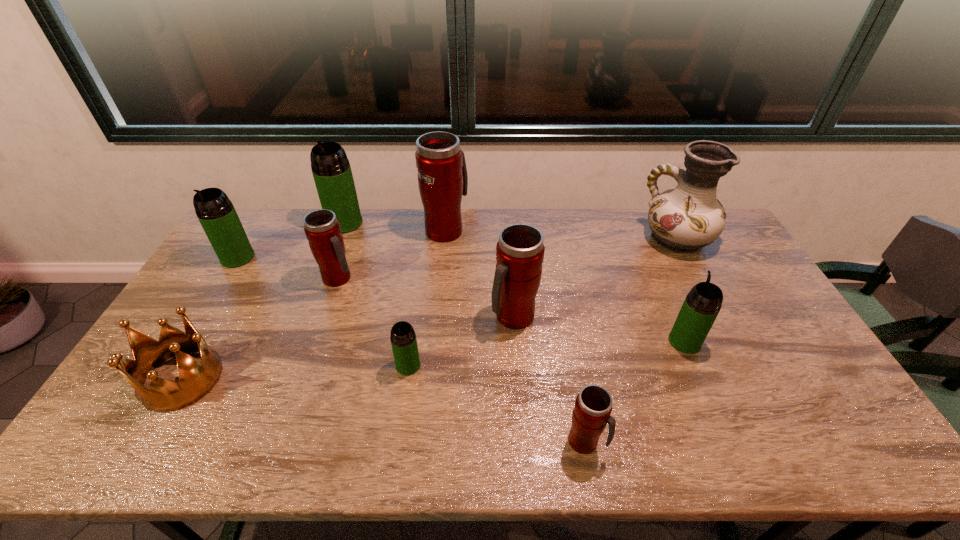
Image resolution: width=960 pixels, height=540 pixels. What are the coordinates of `object that is at the near edge` in the screenshot? It's located at (593, 406).

The width and height of the screenshot is (960, 540). In order to click on thermos bottle that is at the left edge in this screenshot , I will do `click(216, 213)`.

At what (x,y) coordinates should I click in order to perform the action: click on crown that is positioned at the left edge. Please return your answer as a coordinate pair (x, y). Looking at the image, I should click on 197,378.

What are the coordinates of `object at the right edge` in the screenshot? It's located at (684, 219).

Identify the location of object present at the far left corner. This screenshot has height=540, width=960. (216, 213).

Where is `object located at the far right corner`? The image size is (960, 540). object located at the far right corner is located at coordinates click(684, 219).

This screenshot has height=540, width=960. I want to click on vacant space at the far edge of the desktop, so click(539, 209).

The image size is (960, 540). I want to click on free space at the near edge of the desktop, so click(291, 440).

At what (x,y) coordinates should I click in order to perform the action: click on free location at the left edge of the desktop. Please return your answer as a coordinate pair (x, y). Image resolution: width=960 pixels, height=540 pixels. Looking at the image, I should click on (241, 271).

This screenshot has height=540, width=960. What are the coordinates of `vacant space at the far left corner of the desktop` in the screenshot? It's located at (251, 233).